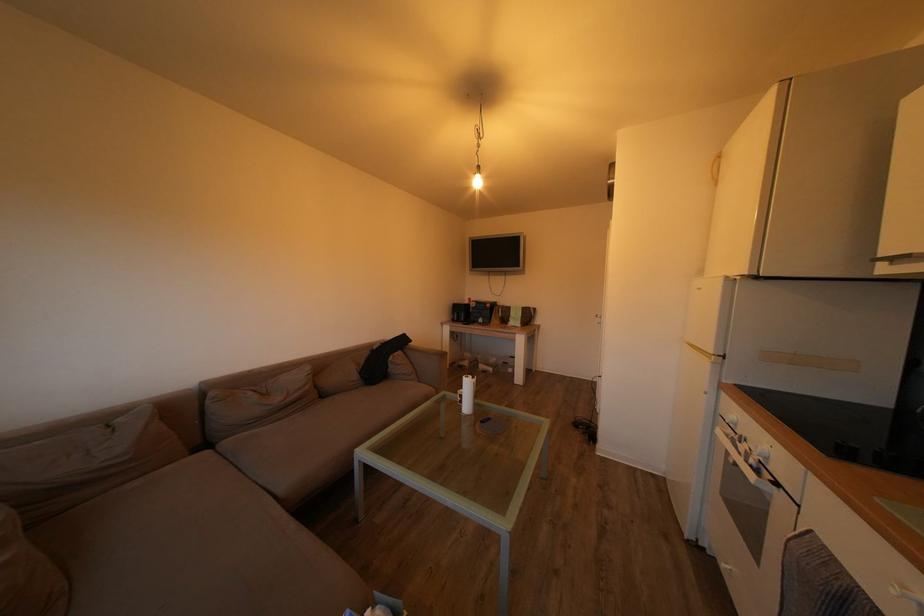
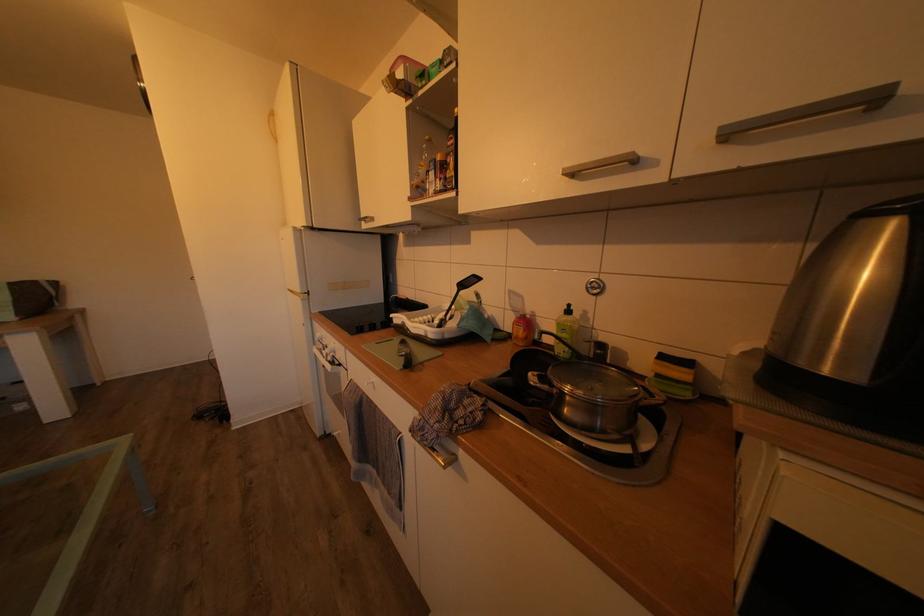
Question: The first image is from the beginning of the video and the second image is from the end. How did the camera likely rotate when shooting the video?

Choices:
 (A) Left
 (B) Right
 (C) Up
 (D) Down

Answer: (B)